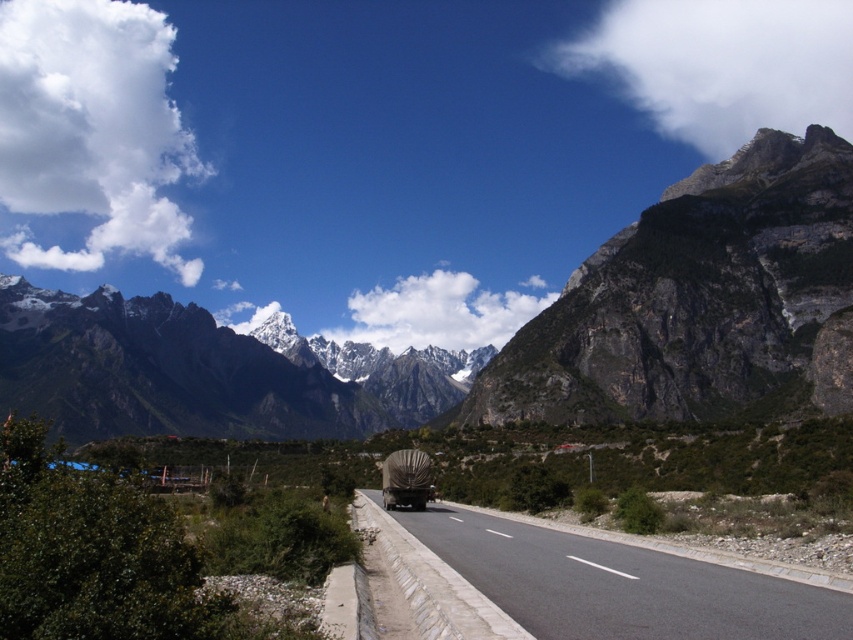
Who is more forward, (827, 365) or (840, 148)?

Positioned in front is point (827, 365).

Identify the location of dark gray rocky mountain range at upper center. (508, 340).

Where is `dark gray rocky mountain range at upper center`? dark gray rocky mountain range at upper center is located at coordinates (508, 340).

What do you see at coordinates (699, 300) in the screenshot? I see `dark gray rocky mountain at upper right` at bounding box center [699, 300].

From the picture: Is dark gray rocky mountain at upper right closer to the viewer compared to black asphalt road at center?

No, dark gray rocky mountain at upper right is further to the viewer.

Between point (602, 372) and point (688, 568), which one is positioned behind?

The point (602, 372) is more distant.

Locate an element on the screen. The image size is (853, 640). dark gray rocky mountain at upper right is located at coordinates (699, 300).

Is dark gray rocky mountain range at upper center thinner than black asphalt road at center?

No.

The width and height of the screenshot is (853, 640). Describe the element at coordinates (508, 340) in the screenshot. I see `dark gray rocky mountain range at upper center` at that location.

The width and height of the screenshot is (853, 640). I want to click on dark gray rocky mountain range at upper center, so click(508, 340).